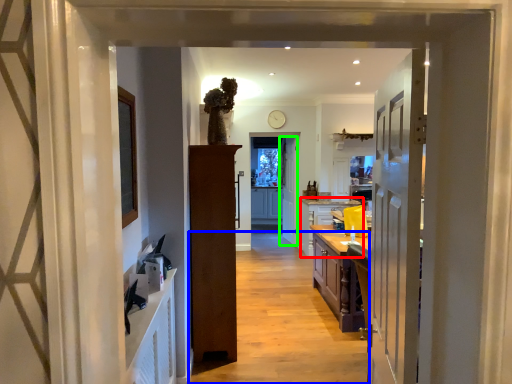
Question: Which object is the farthest from cabinetry (highlighted by a red box)? Choose among these: path (highlighted by a blue box) or door (highlighted by a green box).

Choices:
 (A) path
 (B) door

Answer: (A)